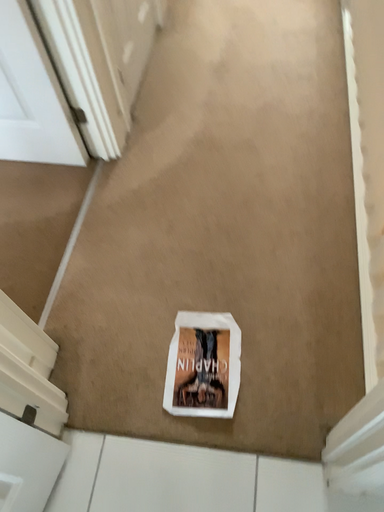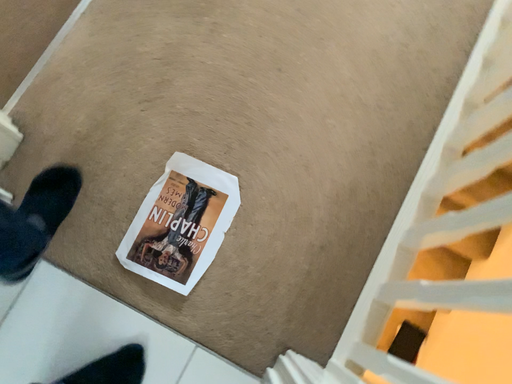
Question: How did the camera likely rotate when shooting the video?

Choices:
 (A) rotated downward
 (B) rotated upward

Answer: (A)